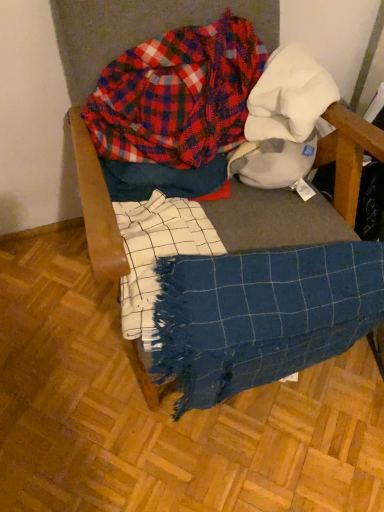
Locate an element on the screen. This screenshot has height=512, width=384. vacant location below blue woven blanket at lower right (from a real-world perspective) is located at coordinates (280, 396).